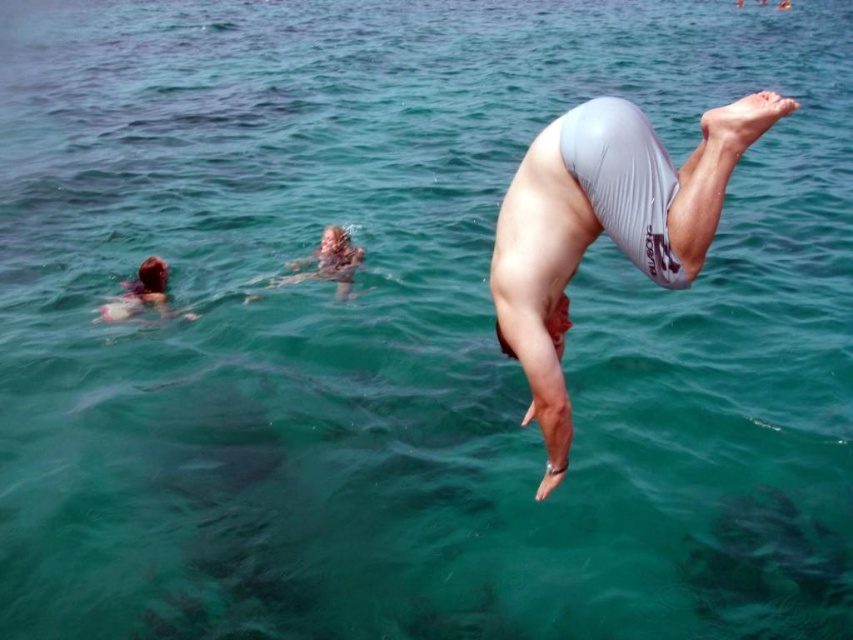
Does white matte shorts at center have a larger size compared to blonde hair swimmer at left?

Correct, white matte shorts at center is larger in size than blonde hair swimmer at left.

Between white matte shorts at center and blonde hair swimmer at left, which one has less height?

blonde hair swimmer at left is shorter.

Between point (532, 282) and point (158, 289), which one is positioned behind?

Positioned behind is point (158, 289).

You are a GUI agent. You are given a task and a screenshot of the screen. Output one action in this format:
    pyautogui.click(x=<x>, y=<y>)
    Task: Click on the white matte shorts at center
    This screenshot has height=640, width=853.
    Given the screenshot: What is the action you would take?
    pyautogui.click(x=604, y=227)